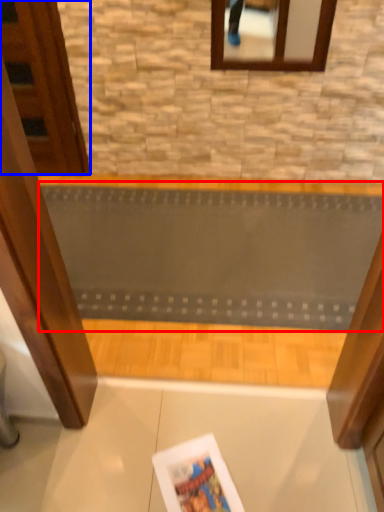
Question: Which object is further to the camera taking this photo, ramp (highlighted by a red box) or door (highlighted by a blue box)?

Choices:
 (A) ramp
 (B) door

Answer: (B)